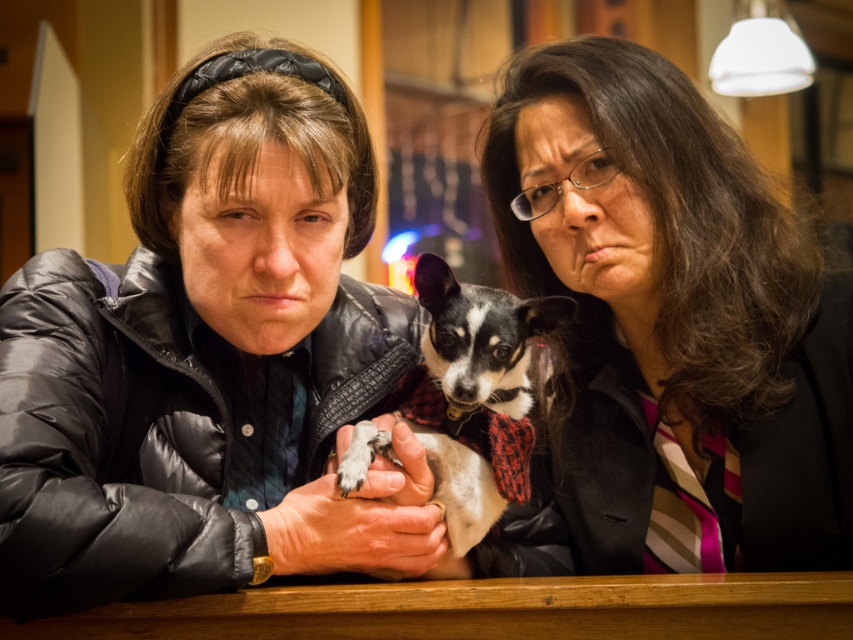
Between black quilted jacket at center and white and black fur at center, which one appears on the left side from the viewer's perspective?

From the viewer's perspective, black quilted jacket at center appears more on the left side.

Locate an element on the screen. black quilted jacket at center is located at coordinates (209, 356).

This screenshot has height=640, width=853. What are the coordinates of `black quilted jacket at center` in the screenshot? It's located at (209, 356).

Identify the location of black quilted jacket at center. This screenshot has width=853, height=640. (209, 356).

Is black quilted jacket at center shorter than matte black jacket at center?

Yes, black quilted jacket at center is shorter than matte black jacket at center.

Does black quilted jacket at center appear on the right side of matte black jacket at center?

Incorrect, black quilted jacket at center is not on the right side of matte black jacket at center.

Locate an element on the screen. This screenshot has height=640, width=853. black quilted jacket at center is located at coordinates (209, 356).

Is the position of matte black jacket at center more distant than that of white and black fur at center?

Yes, matte black jacket at center is further from the viewer.

Can you confirm if matte black jacket at center is shorter than white and black fur at center?

In fact, matte black jacket at center may be taller than white and black fur at center.

Between point (531, 259) and point (447, 460), which one is positioned in front?

Point (447, 460) is more forward.

Locate an element on the screen. matte black jacket at center is located at coordinates (670, 326).